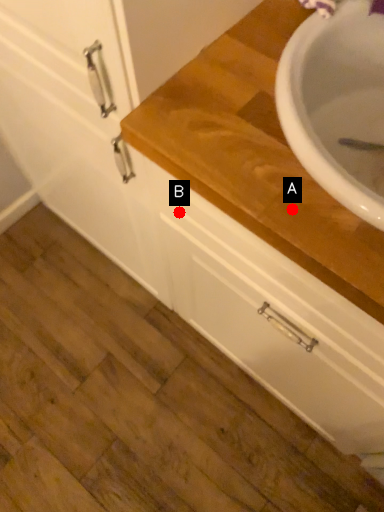
Question: Two points are circled on the image, labeled by A and B beside each circle. Among these points, which one is nearest to the camera?

Choices:
 (A) A is closer
 (B) B is closer

Answer: (A)